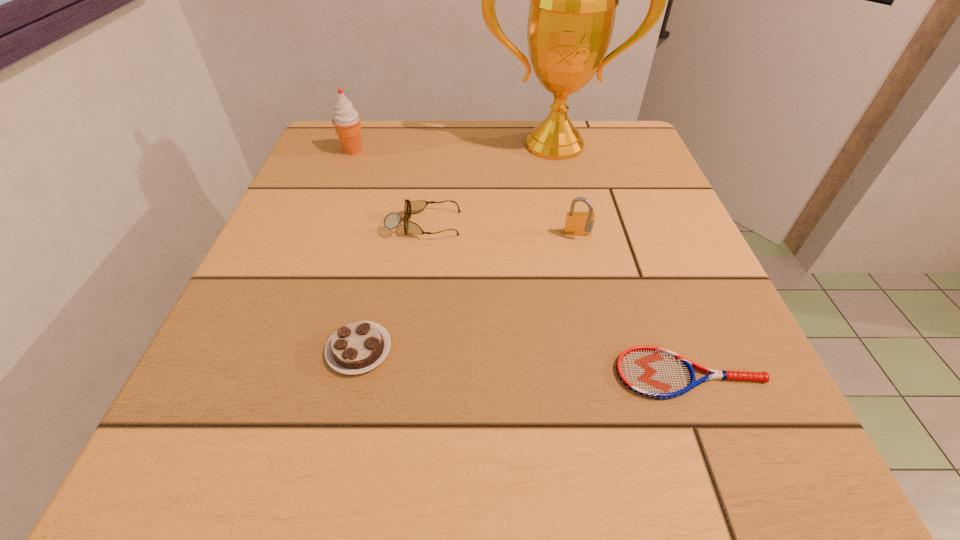
The image size is (960, 540). Identify the location of object that is at the far right corner. click(x=573, y=0).

Identify the location of vacant area at the far edge. This screenshot has height=540, width=960. (403, 172).

Where is `vacant space at the near edge`? vacant space at the near edge is located at coordinates (498, 474).

Locate an element on the screen. free region at the left edge of the desktop is located at coordinates click(x=301, y=312).

Image resolution: width=960 pixels, height=540 pixels. In the image, there is a desktop. Find the location of `free space at the right edge`. free space at the right edge is located at coordinates (687, 317).

This screenshot has width=960, height=540. In the image, there is a desktop. Identify the location of vacant space at the far left corner. (345, 171).

Where is `vacant space at the near left corner of the desktop`? The image size is (960, 540). vacant space at the near left corner of the desktop is located at coordinates (226, 456).

Find the location of `free space between the tennis racket and the award`. free space between the tennis racket and the award is located at coordinates (622, 259).

This screenshot has height=540, width=960. I want to click on vacant space that is in between the shortest object and the padlock, so click(x=634, y=305).

Identify the location of vacant area that lies between the second tallest object and the third tallest object. Image resolution: width=960 pixels, height=540 pixels. (466, 193).